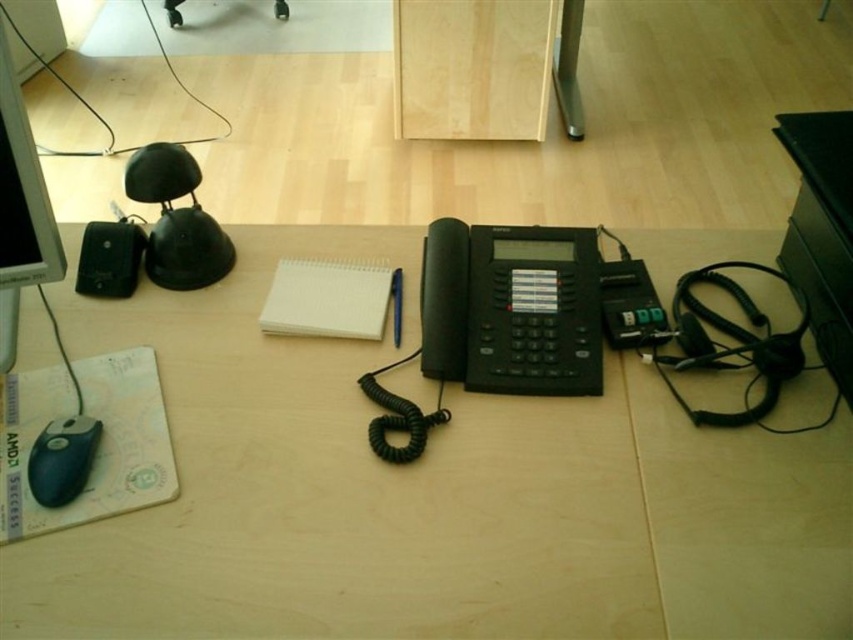
Question: Does matte black monitor at left come in front of black rubber mouse at lower left?

Choices:
 (A) yes
 (B) no

Answer: (A)

Question: Which object is closer to the camera taking this photo?

Choices:
 (A) black rubberized lamp at left
 (B) white paper notepad at center
 (C) matte black monitor at left
 (D) matte black telephone at center

Answer: (C)

Question: Which of the following is the farthest from the observer?

Choices:
 (A) black rubberized lamp at left
 (B) matte black monitor at left
 (C) black rubber mouse at lower left

Answer: (A)

Question: Which point is closer to the camera taking this photo?

Choices:
 (A) (378, 266)
 (B) (57, 268)
 (C) (165, 253)
 (D) (454, 387)

Answer: (B)

Question: Is black rubberized lamp at left positioned behind white paper notepad at center?

Choices:
 (A) yes
 (B) no

Answer: (A)

Question: Does matte black telephone at center have a lesser width compared to matte black monitor at left?

Choices:
 (A) yes
 (B) no

Answer: (B)